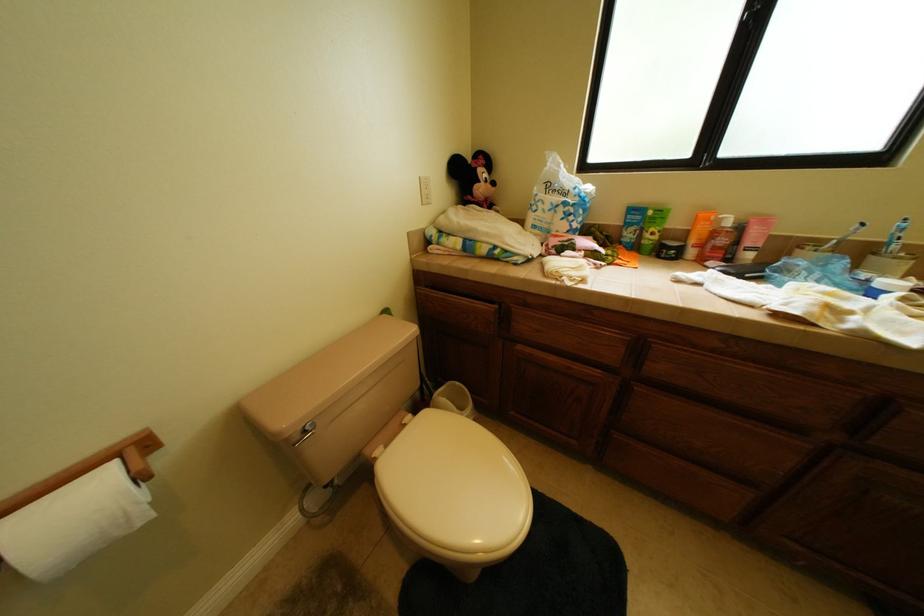
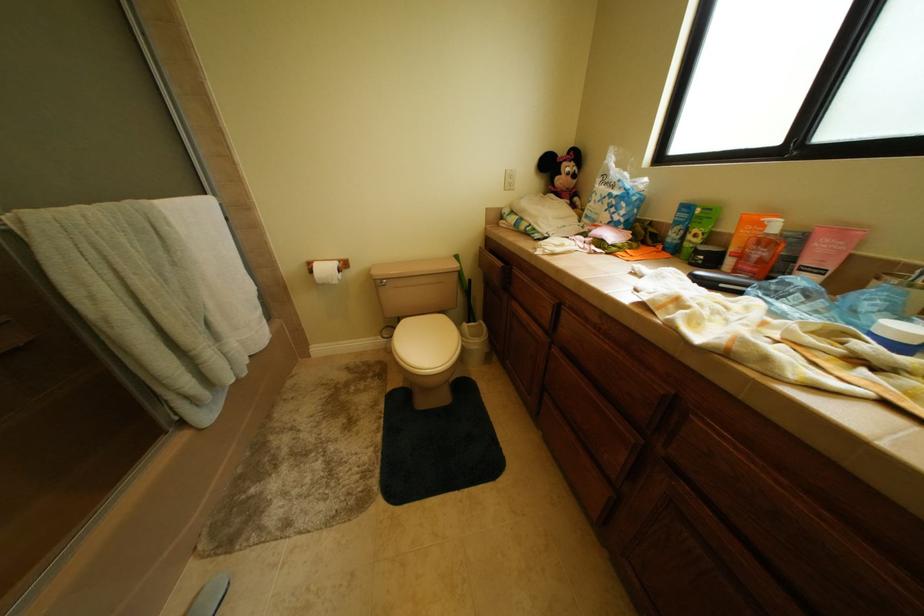
Question: The camera is either moving clockwise (left) or counter-clockwise (right) around the object. The first image is from the beginning of the video and the second image is from the end. Is the camera moving left or right when shooting the video?

Choices:
 (A) Left
 (B) Right

Answer: (B)